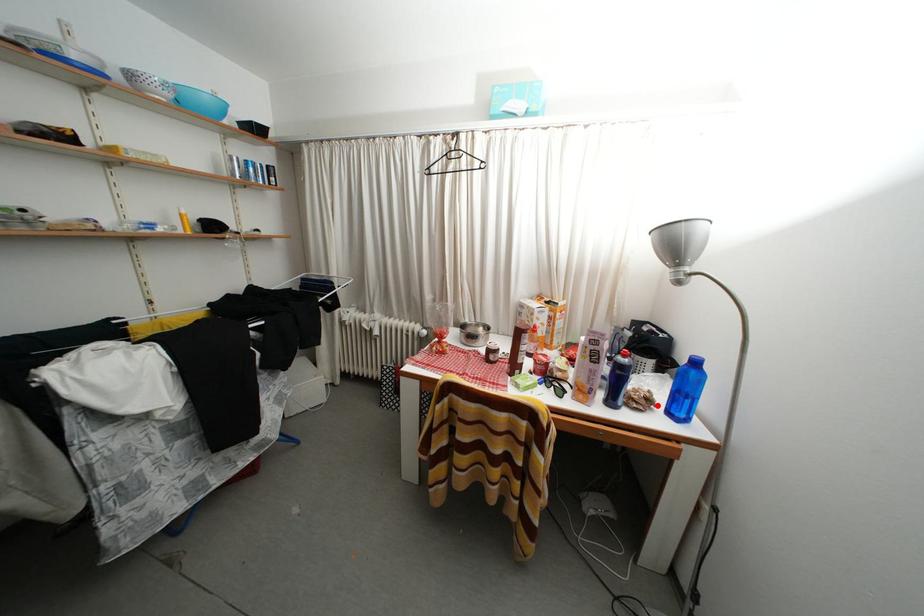
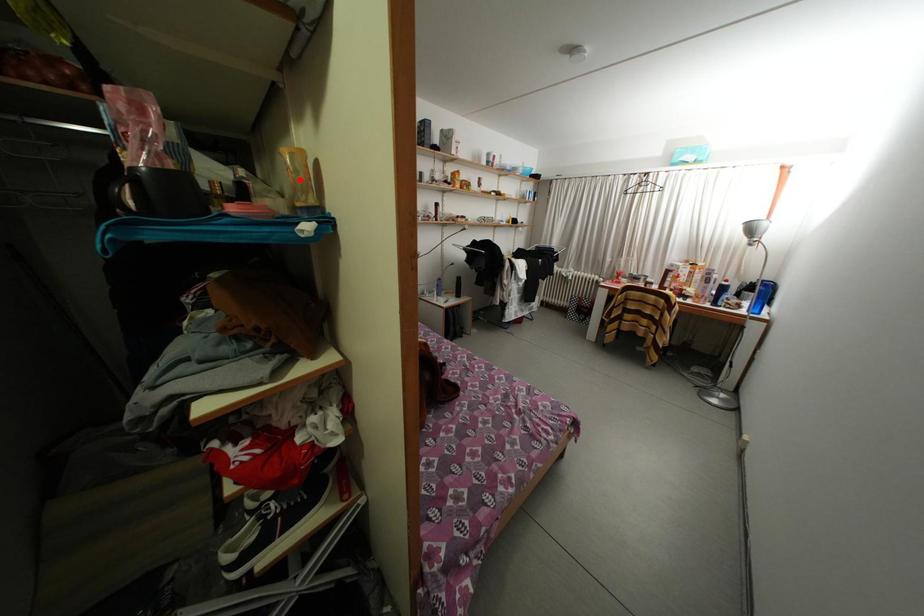
I am providing you with two images of the same scene from different viewpoints. A red point is marked on the first image and another point is marked on the second image. Does the point marked in image1 correspond to the same location as the one in image2?

No